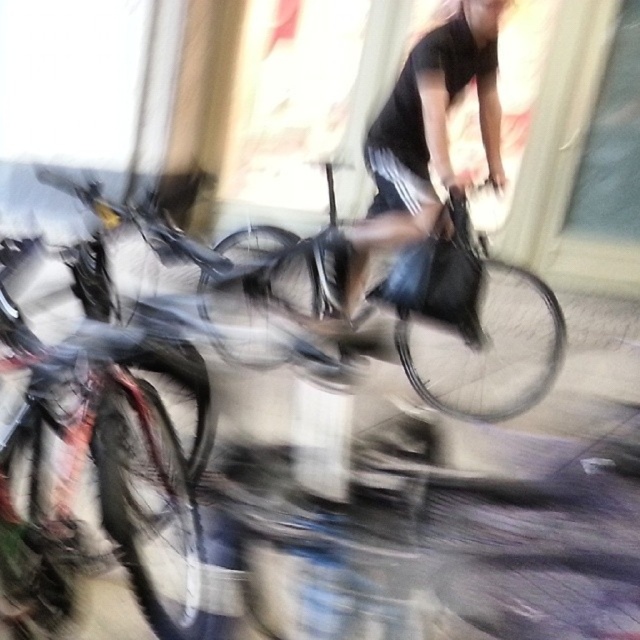
You are a photographer setting up a shoot in the room with the shiny metallic bicycle at left and the shiny metallic bicycle at center. You need to position a light source between them. Which bicycle should you place the light closer to to ensure it reaches both equally, considering their sizes?

The shiny metallic bicycle at left is shorter than the shiny metallic bicycle at center. To ensure the light reaches both equally, place the light source closer to the shiny metallic bicycle at left since it is shorter and requires less distance for even illumination.

You are an interior designer assessing the space for a client who wants to place both the shiny metallic bicycle at left and the black matte bag at center. Based on their positions in the image, which object is closer to the floor?

The shiny metallic bicycle at left is closer to the floor because it is positioned below the black matte bag at center.

You are a photographer trying to capture a clear shot of the shiny metallic bicycle at center and the black matte bag at center in the blurred image. Since the image is motion blurred, which object might be easier to focus on for a sharp photo?

The shiny metallic bicycle at center is in front of the black matte bag at center, so it would be easier to focus on the shiny metallic bicycle at center because it is closer to the camera and less affected by the background blur.